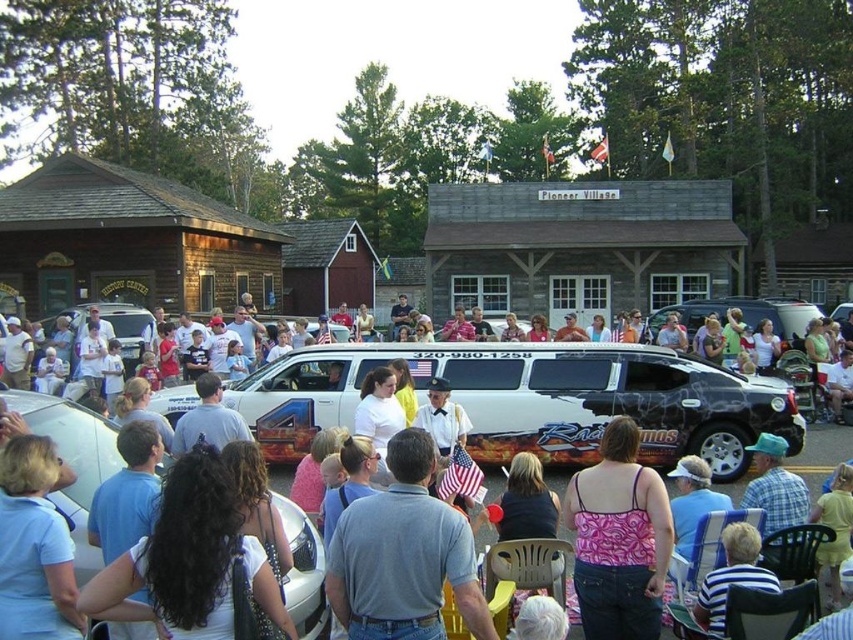
The width and height of the screenshot is (853, 640). What do you see at coordinates (619, 538) in the screenshot? I see `pink floral tank top at center` at bounding box center [619, 538].

Is pink floral tank top at center to the right of white glossy car at lower left from the viewer's perspective?

Yes, pink floral tank top at center is to the right of white glossy car at lower left.

Find the location of a particular element. Image resolution: width=853 pixels, height=640 pixels. pink floral tank top at center is located at coordinates (619, 538).

At what (x,y) coordinates should I click in order to perform the action: click on pink floral tank top at center. Please return your answer as a coordinate pair (x, y). The image size is (853, 640). Looking at the image, I should click on 619,538.

Can you confirm if white glossy car at lower left is positioned above white glossy limousine at center?

Yes.

Between white glossy car at lower left and white glossy limousine at center, which one appears on the right side from the viewer's perspective?

From the viewer's perspective, white glossy limousine at center appears more on the right side.

Find the location of a particular element. The image size is (853, 640). white glossy car at lower left is located at coordinates (73, 460).

At what (x,y) coordinates should I click in order to perform the action: click on white glossy car at lower left. Please return your answer as a coordinate pair (x, y). The image size is (853, 640). Looking at the image, I should click on (73, 460).

The height and width of the screenshot is (640, 853). What do you see at coordinates (619, 538) in the screenshot?
I see `pink floral tank top at center` at bounding box center [619, 538].

Is pink floral tank top at center to the right of white glossy limousine at center from the viewer's perspective?

Incorrect, pink floral tank top at center is not on the right side of white glossy limousine at center.

Does point (624, 508) lie behind point (85, 432)?

No.

Locate an element on the screen. Image resolution: width=853 pixels, height=640 pixels. pink floral tank top at center is located at coordinates (619, 538).